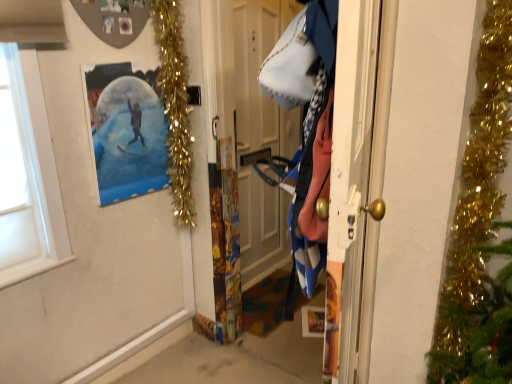
Question: From the image's perspective, would you say blue denim jacket at right is shown under polka dot paper snow globe at upper left?

Choices:
 (A) no
 (B) yes

Answer: (B)

Question: Can you confirm if blue denim jacket at right is wider than polka dot paper snow globe at upper left?

Choices:
 (A) no
 (B) yes

Answer: (B)

Question: Is blue denim jacket at right turned away from polka dot paper snow globe at upper left?

Choices:
 (A) yes
 (B) no

Answer: (B)

Question: Can you confirm if blue denim jacket at right is shorter than polka dot paper snow globe at upper left?

Choices:
 (A) yes
 (B) no

Answer: (B)

Question: Does blue denim jacket at right come behind polka dot paper snow globe at upper left?

Choices:
 (A) no
 (B) yes

Answer: (A)

Question: Does blue denim jacket at right have a larger size compared to polka dot paper snow globe at upper left?

Choices:
 (A) yes
 (B) no

Answer: (A)

Question: Is polka dot paper snow globe at upper left further to camera compared to wooden door at center?

Choices:
 (A) no
 (B) yes

Answer: (A)

Question: Are polka dot paper snow globe at upper left and wooden door at center far apart?

Choices:
 (A) no
 (B) yes

Answer: (A)

Question: Does polka dot paper snow globe at upper left appear on the right side of wooden door at center?

Choices:
 (A) yes
 (B) no

Answer: (B)

Question: Can you confirm if polka dot paper snow globe at upper left is shorter than wooden door at center?

Choices:
 (A) yes
 (B) no

Answer: (A)

Question: Is polka dot paper snow globe at upper left to the left of wooden door at center from the viewer's perspective?

Choices:
 (A) no
 (B) yes

Answer: (B)

Question: Is polka dot paper snow globe at upper left thinner than wooden door at center?

Choices:
 (A) yes
 (B) no

Answer: (A)

Question: Could gold tinsel garland at upper left be considered to be inside wooden door at center?

Choices:
 (A) no
 (B) yes

Answer: (A)